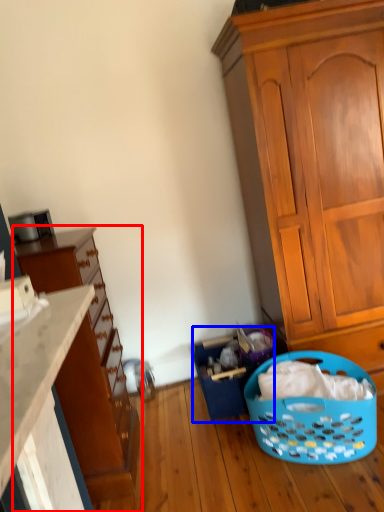
Question: Which point is further to the camera, cupboard (highlighted by a red box) or basket (highlighted by a blue box)?

Choices:
 (A) cupboard
 (B) basket

Answer: (B)